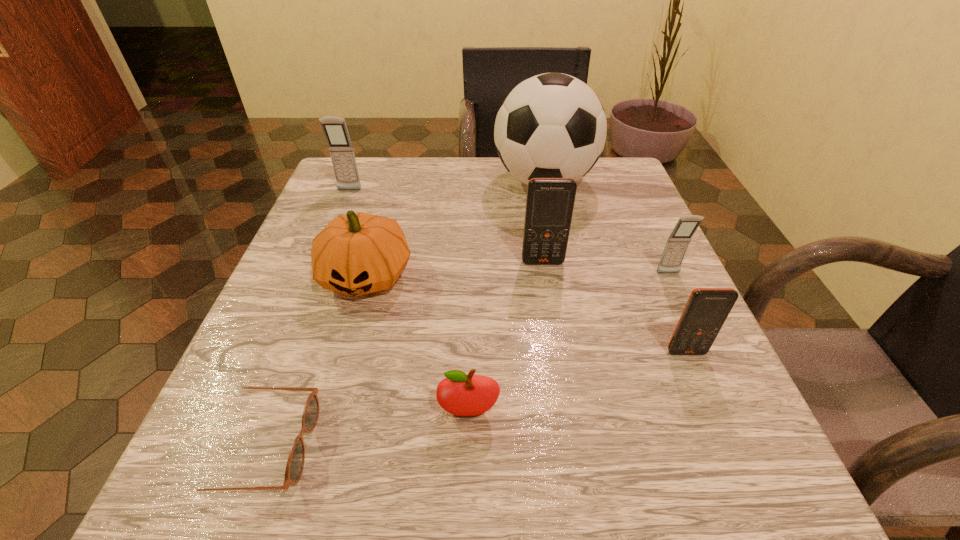
You are a GUI agent. You are given a task and a screenshot of the screen. Output one action in this format:
    pyautogui.click(x=<x>, y=<y>)
    Task: Click on the black soccer ball
    
    Given the screenshot: What is the action you would take?
    pyautogui.click(x=553, y=125)

The width and height of the screenshot is (960, 540). I want to click on the tallest object, so click(x=553, y=125).

The width and height of the screenshot is (960, 540). Find the location of `the left gray cellular telephone`. the left gray cellular telephone is located at coordinates (335, 130).

Where is `the farther gray cellular telephone`? This screenshot has height=540, width=960. the farther gray cellular telephone is located at coordinates (335, 130).

Where is `the third nearest cellular telephone`? This screenshot has height=540, width=960. the third nearest cellular telephone is located at coordinates (550, 201).

The image size is (960, 540). Find the location of `the left orange cellular telephone`. the left orange cellular telephone is located at coordinates pyautogui.click(x=550, y=201).

What are the coordinates of `orange gourd` in the screenshot? It's located at (358, 253).

This screenshot has height=540, width=960. Identify the location of the sixth farthest object. click(706, 310).

The image size is (960, 540). I want to click on the smaller orange cellular telephone, so click(706, 310).

You are a GUI agent. You are given a task and a screenshot of the screen. Output one action in this format:
    pyautogui.click(x=<x>, y=<y>)
    Task: Click on the smaller gray cellular telephone
    
    Given the screenshot: What is the action you would take?
    [x=676, y=246]